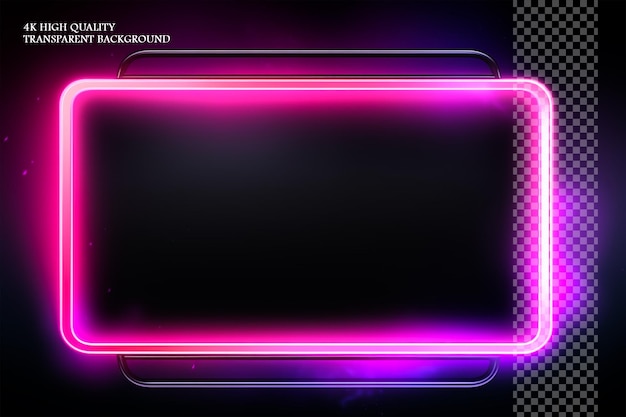
You are a GUI agent. You are given a task and a screenshot of the screen. Output one action in this format:
    pyautogui.click(x=<x>, y=<y>)
    Task: Click on the pink light
    
    Given the screenshot: What is the action you would take?
    pyautogui.click(x=44, y=213), pyautogui.click(x=392, y=333)